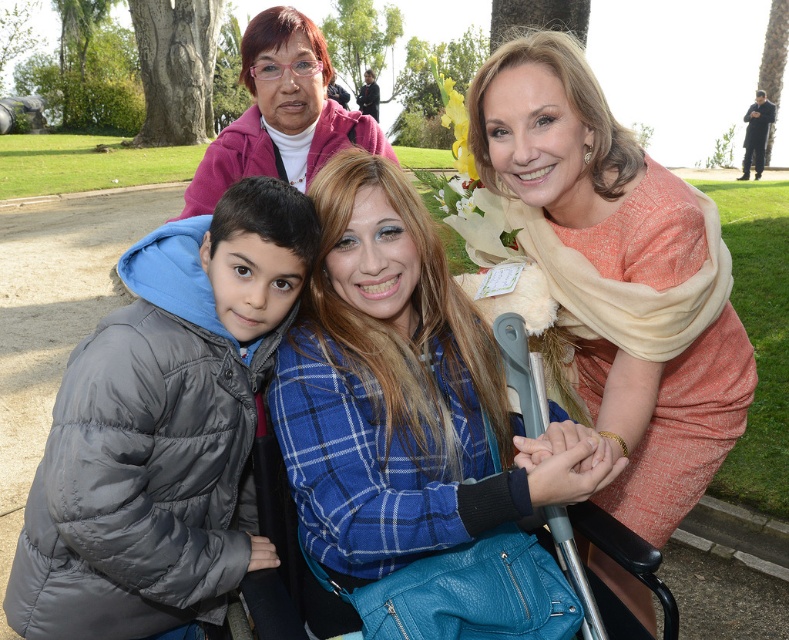
You are a fashion designer observing the scene. You need to determine which item of clothing has a narrower silhouette between the matte orange dress at center and the matte pink sweater at upper left. Which one is it?

→ The matte orange dress at center has a narrower silhouette than the matte pink sweater at upper left according to the description.

You are standing in a park and see a woman in a blue plaid jacket sitting in a wheelchair and a teal handbag on her lap. There is also a point marked at coordinates [393,397]. Can you determine if the blue plaid jacket is located at that point?

The blue plaid jacket is represented by the point at coordinates [393,397], so yes, the blue plaid jacket is located at that point.